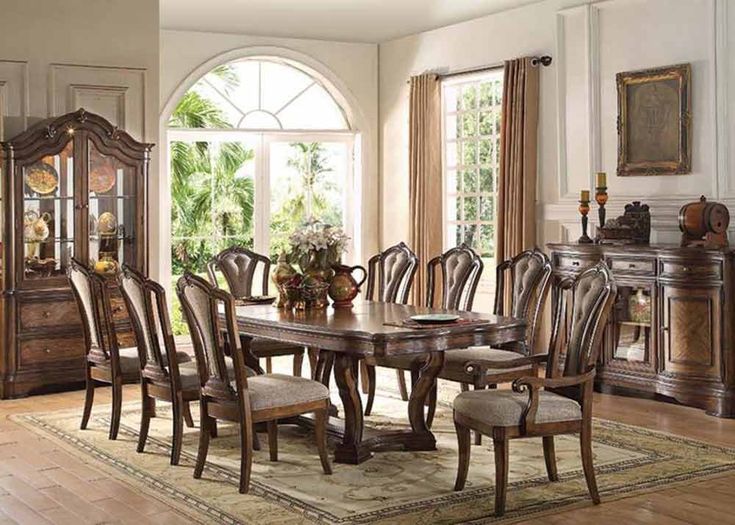
Find the location of a particular element. The width and height of the screenshot is (735, 525). chairs is located at coordinates (112, 370), (168, 388), (258, 412), (516, 420), (528, 280), (462, 266), (401, 264), (245, 258).